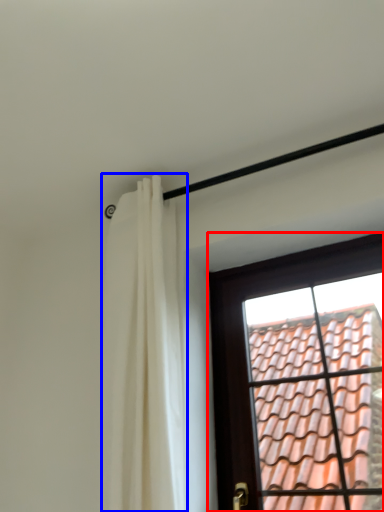
Question: Among these objects, which one is nearest to the camera, window (highlighted by a red box) or curtain (highlighted by a blue box)?

Choices:
 (A) window
 (B) curtain

Answer: (B)